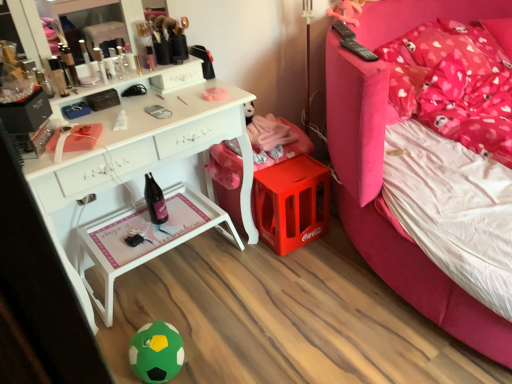
In order to click on vacant space situated above white wood tray at lower center (from a real-world perspective) in this screenshot , I will do `click(159, 227)`.